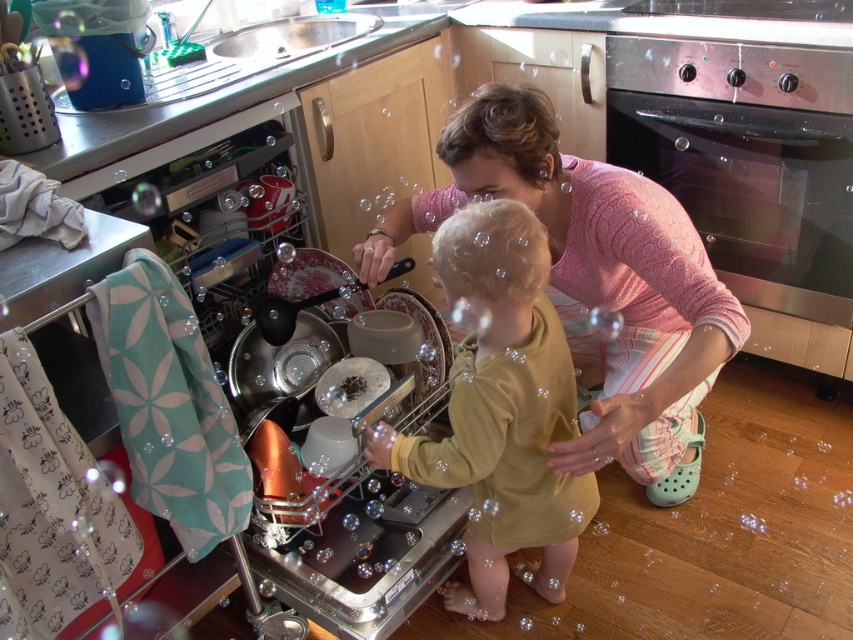
Question: Which of the following is the closest to the observer?

Choices:
 (A) (426, 269)
 (B) (804, 269)
 (C) (670, 477)
 (D) (496, 467)

Answer: (D)

Question: Based on their relative distances, which object is farther from the pink textured sweater at center?

Choices:
 (A) matte yellow shirt at center
 (B) stainless steel oven at lower right
 (C) metallic silver dish washer at left

Answer: (B)

Question: Which point appears closest to the camera in this image?

Choices:
 (A) (485, 237)
 (B) (759, 118)
 (C) (186, 144)
 (D) (564, 227)

Answer: (A)

Question: Is stainless steel oven at lower right bigger than metallic silver dish washer at left?

Choices:
 (A) no
 (B) yes

Answer: (A)

Question: Is pink textured sweater at center thinner than stainless steel oven at lower right?

Choices:
 (A) yes
 (B) no

Answer: (B)

Question: Can you confirm if matte yellow shirt at center is wider than metallic silver dish washer at left?

Choices:
 (A) yes
 (B) no

Answer: (B)